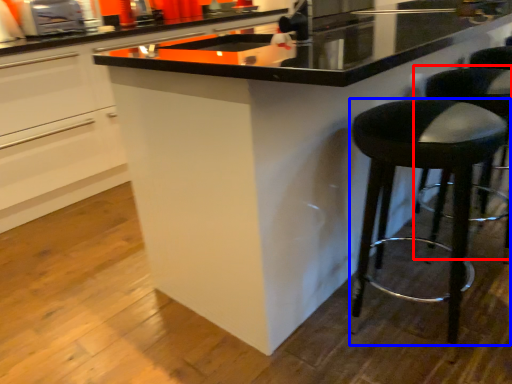
Question: Among these objects, which one is nearest to the camera, bar stool (highlighted by a red box) or stool (highlighted by a blue box)?

Choices:
 (A) bar stool
 (B) stool

Answer: (B)